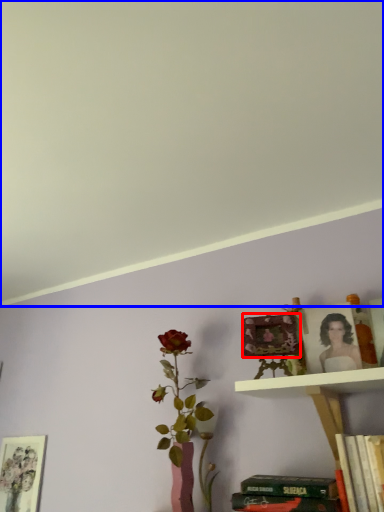
Question: Which of the following is the farthest to the observer, picture frame (highlighted by a red box) or backdrop (highlighted by a blue box)?

Choices:
 (A) picture frame
 (B) backdrop

Answer: (A)